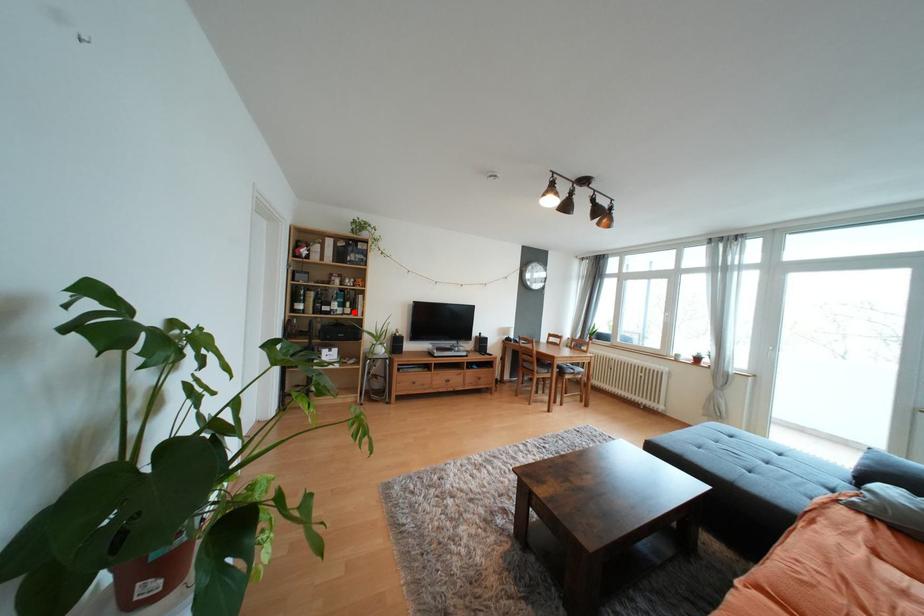
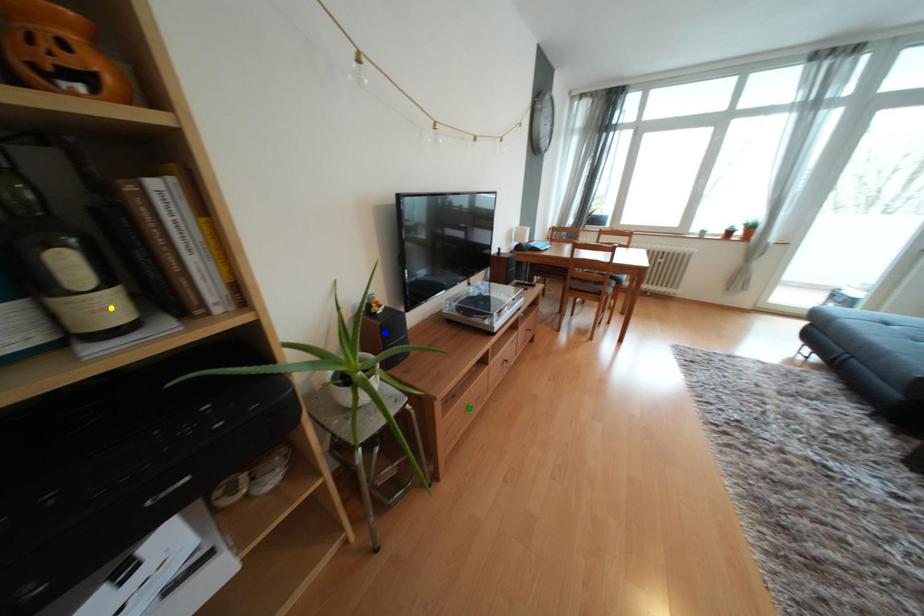
Question: I am providing you with two images of the same scene from different viewpoints. A red point is marked on the first image. You are given multiple points on the second image. Can you choose the point in image 2 that corresponds to the point in image 1?

Choices:
 (A) yellow point
 (B) blue point
 (C) green point

Answer: (A)